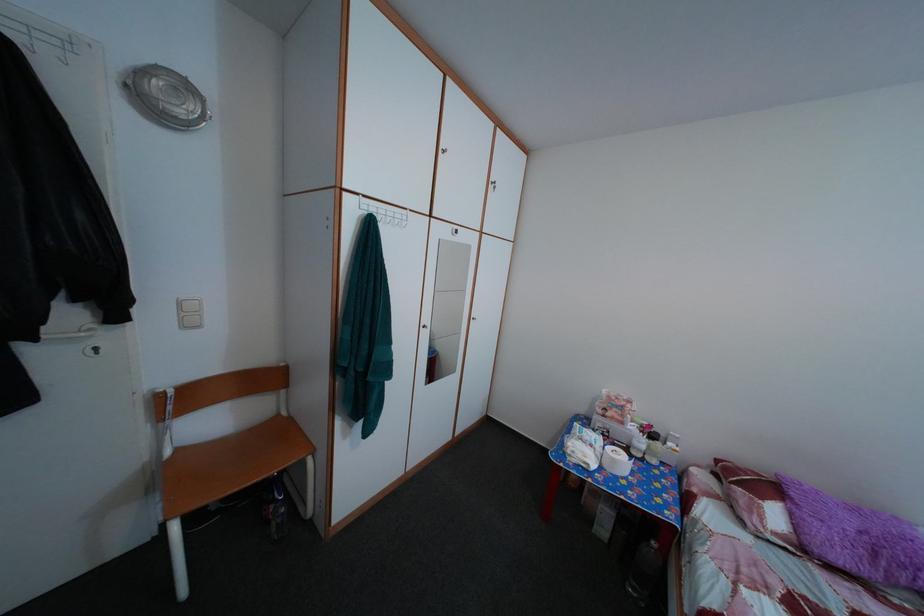
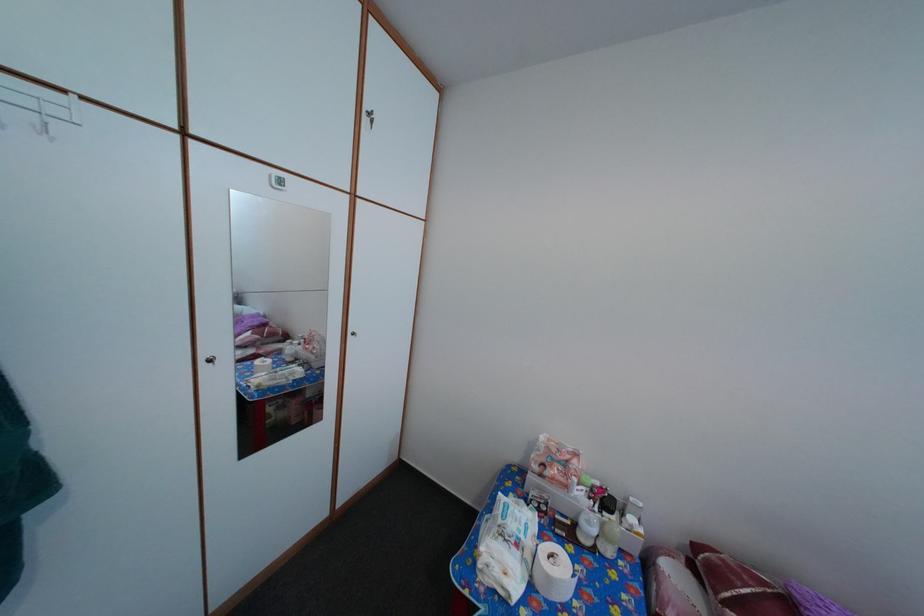
Find the pixel in the second image that matches point (623, 468) in the first image.

(558, 586)